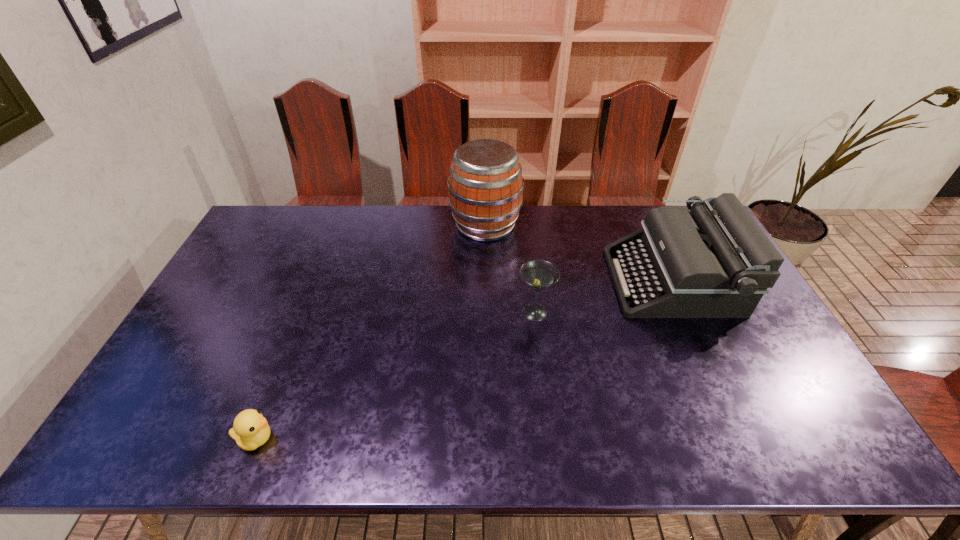
Find the location of a particular element. The height and width of the screenshot is (540, 960). unoccupied area between the martini and the second tallest object is located at coordinates (603, 296).

Identify the location of vacant space that is in between the leftmost object and the rightmost object. The image size is (960, 540). (464, 360).

This screenshot has width=960, height=540. I want to click on blank region between the third tallest object and the tallest object, so click(510, 269).

Find the location of a particular element. This screenshot has height=540, width=960. free space that is in between the leftmost object and the typewriter is located at coordinates (464, 360).

You are a GUI agent. You are given a task and a screenshot of the screen. Output one action in this format:
    pyautogui.click(x=<x>, y=<y>)
    Task: Click on the object that is the second closest to the typewriter
    The image size is (960, 540).
    Given the screenshot: What is the action you would take?
    pyautogui.click(x=485, y=186)

This screenshot has height=540, width=960. Find the location of `object that stands as the second closest to the leftmost object`. object that stands as the second closest to the leftmost object is located at coordinates (485, 186).

Identify the location of free space that satisfies the following two spatial constraints: 1. on the front side of the tallest object; 2. on the face of the leftmost object. (489, 439).